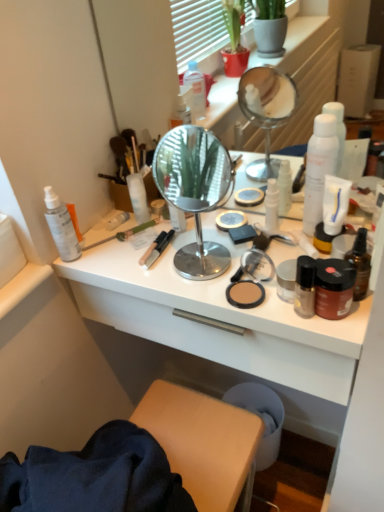
The height and width of the screenshot is (512, 384). What are the coordinates of `vacant space to the right of white matte bottle at center, the 5th toiletry viewed from the right` in the screenshot? It's located at (201, 224).